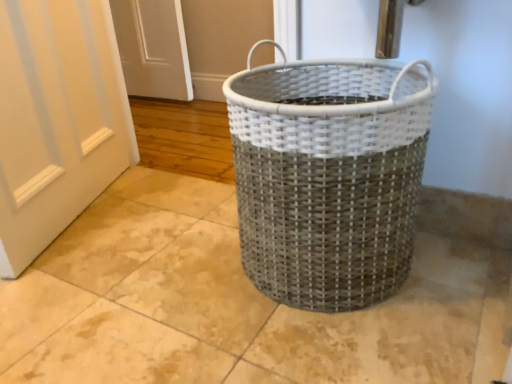
At what (x,y) coordinates should I click in order to perform the action: click on vacant area that lies between white painted wood door at left and white woven basket at center. Please return your answer as a coordinate pair (x, y). This screenshot has width=512, height=384. Looking at the image, I should click on (167, 252).